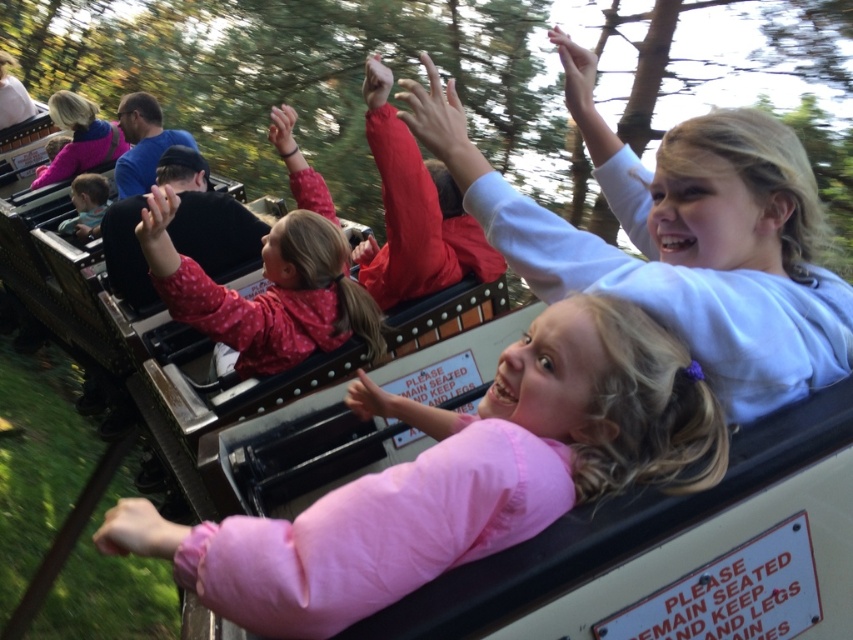
Is white matte shirt at upper right thinner than pink dotted jacket at center?

Incorrect, white matte shirt at upper right's width is not less than pink dotted jacket at center's.

Between white matte shirt at upper right and pink dotted jacket at center, which one has more height?

white matte shirt at upper right

You are a GUI agent. You are given a task and a screenshot of the screen. Output one action in this format:
    pyautogui.click(x=<x>, y=<y>)
    Task: Click on the white matte shirt at upper right
    
    Given the screenshot: What is the action you would take?
    pyautogui.click(x=676, y=236)

The image size is (853, 640). I want to click on white matte shirt at upper right, so click(x=676, y=236).

What do you see at coordinates (459, 476) in the screenshot? I see `pink fabric at center` at bounding box center [459, 476].

Does pink fabric at center have a lesser width compared to matte pink jacket at upper left?

Yes.

Is point (94, 532) less distant than point (106, 157)?

Yes, point (94, 532) is in front of point (106, 157).

Where is `pink fabric at center`? The image size is (853, 640). pink fabric at center is located at coordinates (459, 476).

Does pink fabric at center have a larger size compared to pink dotted jacket at center?

Yes, pink fabric at center is bigger than pink dotted jacket at center.

Is point (490, 492) farther from viewer compared to point (167, 211)?

No.

Identify the location of pink fabric at center. The image size is (853, 640). (459, 476).